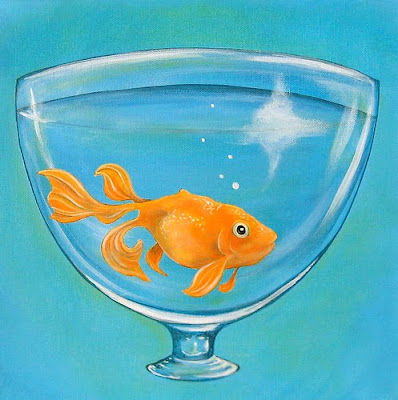
Locate an element on the screen. The image size is (398, 400). glass stem is located at coordinates (196, 348).